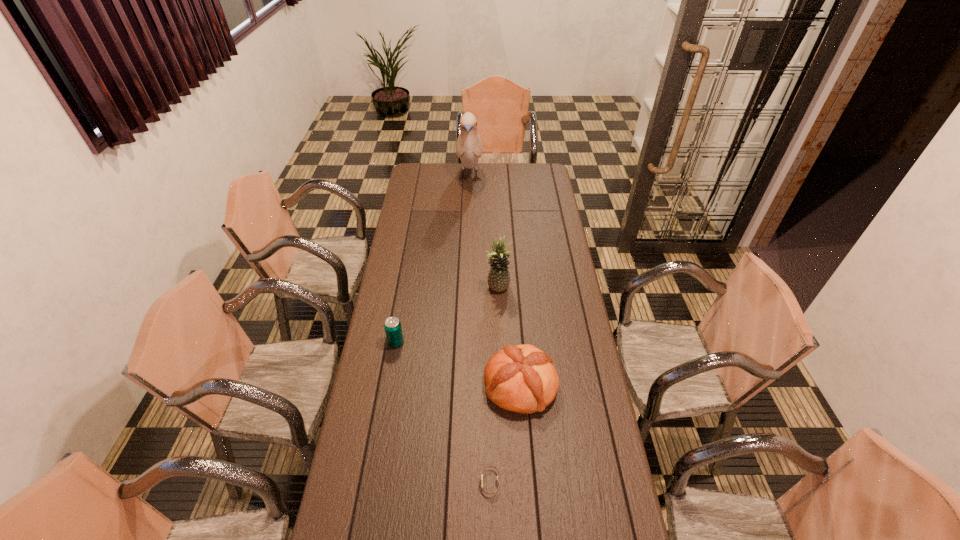
This screenshot has width=960, height=540. I want to click on free space located on the back of the second tallest object, so coord(495,235).

Where is `vacant space located 0.110m on the left of the bread`? This screenshot has height=540, width=960. vacant space located 0.110m on the left of the bread is located at coordinates (455, 384).

The image size is (960, 540). I want to click on vacant space located on the right of the third nearest object, so point(436,342).

The image size is (960, 540). In order to click on vacant space located on the face of the watch in this screenshot , I will do `click(425, 482)`.

You are a GUI agent. You are given a task and a screenshot of the screen. Output one action in this format:
    pyautogui.click(x=<x>, y=<y>)
    Task: Click on the vacant space located on the face of the watch
    Image resolution: width=960 pixels, height=540 pixels.
    Given the screenshot: What is the action you would take?
    pyautogui.click(x=453, y=482)

Find the location of a particular element. This screenshot has height=540, width=960. vacant space located on the face of the watch is located at coordinates (456, 482).

Find the location of `object at the far edge`. object at the far edge is located at coordinates (469, 146).

Locate an element on the screen. This screenshot has width=960, height=540. object present at the left edge is located at coordinates (393, 329).

Where is `object situated at the right edge`? This screenshot has height=540, width=960. object situated at the right edge is located at coordinates (522, 378).

Where is `free space at the far edge of the desktop`? The image size is (960, 540). free space at the far edge of the desktop is located at coordinates (441, 176).